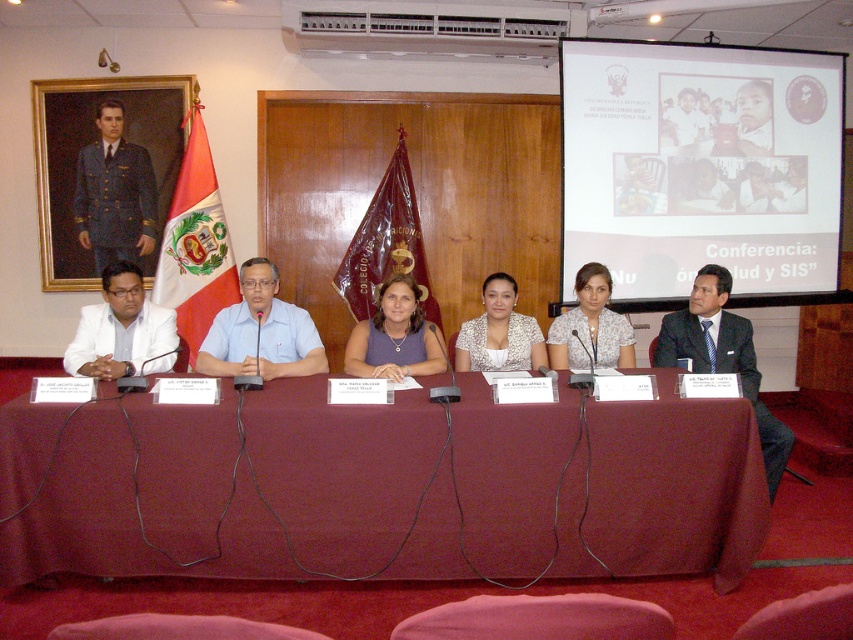
Who is more forward, (x=200, y=524) or (x=398, y=291)?

Point (x=200, y=524)

Between maroon fabric table at center and matte white blouse at center, which one is positioned lower?

maroon fabric table at center is lower down.

Find the location of a particular element. This screenshot has width=853, height=640. maroon fabric table at center is located at coordinates (675, 486).

You are a GUI agent. You are given a task and a screenshot of the screen. Output one action in this format:
    pyautogui.click(x=<x>, y=<y>)
    Task: Click on the maroon fabric table at center
    This screenshot has height=640, width=853.
    Given the screenshot: What is the action you would take?
    pyautogui.click(x=675, y=486)

Does point (126, 244) lie behind point (503, 326)?

Yes, point (126, 244) is behind point (503, 326).

The width and height of the screenshot is (853, 640). Describe the element at coordinates (114, 193) in the screenshot. I see `matte black uniform at left` at that location.

Locate an element on the screen. The width and height of the screenshot is (853, 640). matte black uniform at left is located at coordinates (114, 193).

Is point (148, 230) positioned after point (123, 292)?

Yes, point (148, 230) is farther from viewer.

Who is taller, matte black uniform at left or white matte suit at left?

matte black uniform at left is taller.

Between point (115, 148) and point (99, 312), which one is positioned behind?

The point (115, 148) is more distant.

Locate an element on the screen. This screenshot has height=640, width=853. matte black uniform at left is located at coordinates (114, 193).